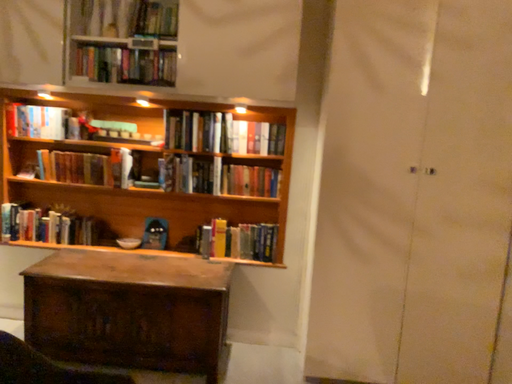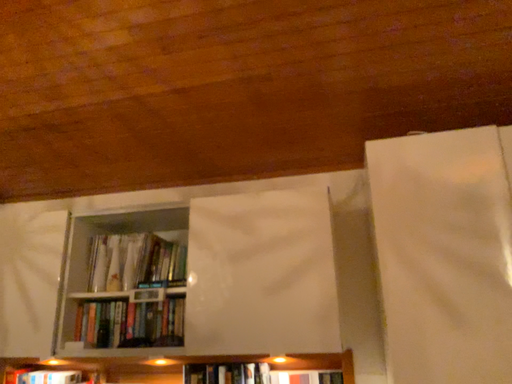
Question: Which way did the camera rotate in the video?

Choices:
 (A) rotated right
 (B) rotated left

Answer: (B)